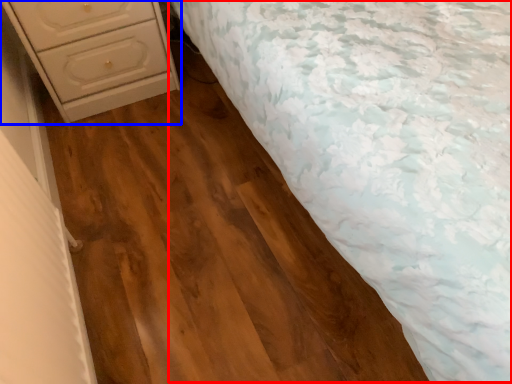
Question: Which object appears closest to the camera in this image, bed (highlighted by a red box) or chest of drawers (highlighted by a blue box)?

Choices:
 (A) bed
 (B) chest of drawers

Answer: (A)